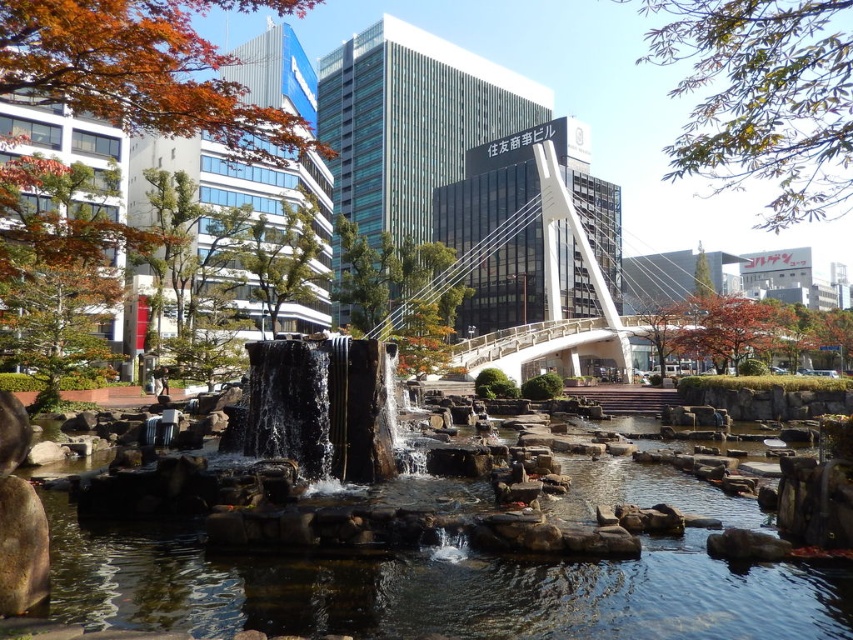
Is clear water at center shorter than white glass bridge at center?

Yes.

Does point (619, 492) lie behind point (488, 234)?

No, it is not.

Between point (581, 483) and point (677, 323), which one is positioned in front?

Point (581, 483) is in front.

This screenshot has width=853, height=640. In order to click on clear water at center in this screenshot , I will do `click(432, 592)`.